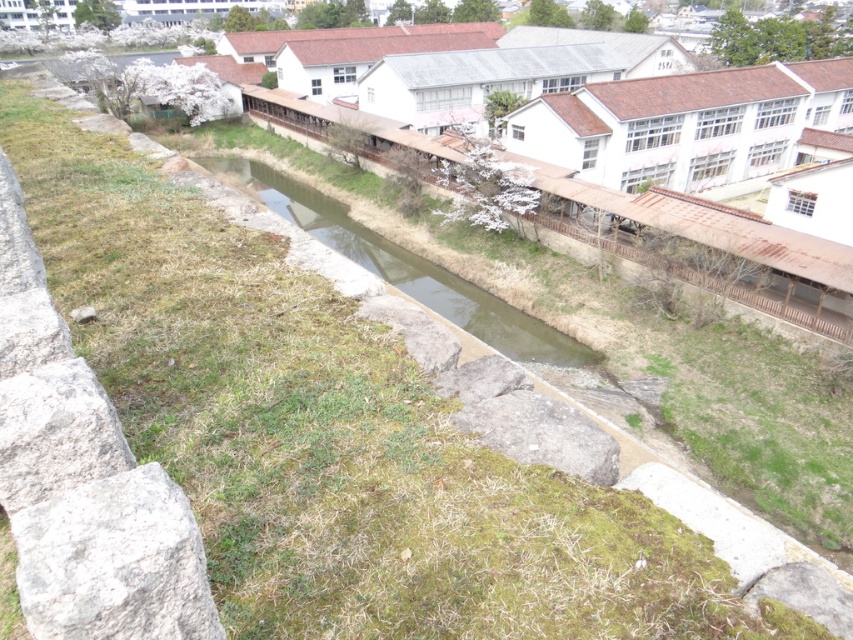
You are a small insect trying to cross from the gray rough stone at lower left to the green grassy stream at center. Which path is narrower?

The gray rough stone at lower left is thinner than the green grassy stream at center, so the path on the gray rough stone at lower left is narrower.

You are a small animal trying to cross from the gray rough stone at lower left to the green grassy stream at center. Which object is lower in height?

The gray rough stone at lower left is shorter than the green grassy stream at center, so the gray rough stone at lower left is lower in height.